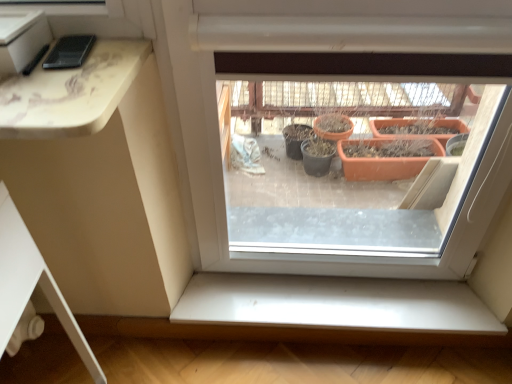
The height and width of the screenshot is (384, 512). Find the location of `white smooth window sill at lower center`. white smooth window sill at lower center is located at coordinates (335, 303).

The height and width of the screenshot is (384, 512). Describe the element at coordinates (335, 303) in the screenshot. I see `white smooth window sill at lower center` at that location.

Describe the element at coordinates (21, 39) in the screenshot. This screenshot has height=384, width=512. I see `matte black phone at upper left` at that location.

Measure the distance between matte black phone at upper left and camera.

They are 72.07 centimeters apart.

This screenshot has height=384, width=512. I want to click on matte black phone at upper left, so click(21, 39).

In order to face matte black phone at upper left, should I rotate leftwards or rightwards?

To face it directly, rotate left by 32.433 degrees.

Locate an element on the screen. The width and height of the screenshot is (512, 384). white smooth window sill at lower center is located at coordinates (335, 303).

Which is more to the left, matte black phone at upper left or white smooth window sill at lower center?

Positioned to the left is matte black phone at upper left.

Is matte black phone at upper left in front of white smooth window sill at lower center?

Yes, it is.

Considering the points (9, 40) and (424, 289), which point is behind, point (9, 40) or point (424, 289)?

The point (424, 289) is farther.

From the image's perspective, between matte black phone at upper left and white smooth window sill at lower center, which one is located above?

matte black phone at upper left is shown above in the image.

From a real-world perspective, is matte black phone at upper left located higher than white smooth window sill at lower center?

Yes, from a real-world perspective, matte black phone at upper left is on top of white smooth window sill at lower center.

Considering the sizes of objects matte black phone at upper left and white smooth window sill at lower center in the image provided, who is thinner, matte black phone at upper left or white smooth window sill at lower center?

Thinner between the two is matte black phone at upper left.

Does matte black phone at upper left have a greater height compared to white smooth window sill at lower center?

In fact, matte black phone at upper left may be shorter than white smooth window sill at lower center.

Considering the sizes of objects matte black phone at upper left and white smooth window sill at lower center in the image provided, who is bigger, matte black phone at upper left or white smooth window sill at lower center?

Bigger between the two is white smooth window sill at lower center.

Is white smooth window sill at lower center a part of matte black phone at upper left?

No.

Is matte black phone at upper left in contact with white smooth window sill at lower center?

No, matte black phone at upper left is not next to white smooth window sill at lower center.

Is matte black phone at upper left facing towards white smooth window sill at lower center?

No, matte black phone at upper left does not turn towards white smooth window sill at lower center.

Image resolution: width=512 pixels, height=384 pixels. I want to click on window box on the left of the white smooth window sill at lower center, so click(x=21, y=39).

Does white smooth window sill at lower center appear on the right side of matte black phone at upper left?

Correct, you'll find white smooth window sill at lower center to the right of matte black phone at upper left.

Who is more distant, white smooth window sill at lower center or matte black phone at upper left?

white smooth window sill at lower center is behind.

Is point (331, 278) positioned before point (48, 42)?

No, (331, 278) is behind (48, 42).

From the image's perspective, is white smooth window sill at lower center on matte black phone at upper left?

Incorrect, from the image's perspective, white smooth window sill at lower center is lower than matte black phone at upper left.

From a real-world perspective, is white smooth window sill at lower center above or below matte black phone at upper left?

From a real-world perspective, white smooth window sill at lower center is physically below matte black phone at upper left.

Looking at this image, looking at their sizes, would you say white smooth window sill at lower center is wider or thinner than matte black phone at upper left?

Clearly, white smooth window sill at lower center has more width compared to matte black phone at upper left.

In the scene shown: Is white smooth window sill at lower center shorter than matte black phone at upper left?

No.

Can you confirm if white smooth window sill at lower center is smaller than matte black phone at upper left?

No.

Based on the photo, is white smooth window sill at lower center not within matte black phone at upper left?

That's correct, white smooth window sill at lower center is outside of matte black phone at upper left.

Is the surface of white smooth window sill at lower center in direct contact with matte black phone at upper left?

No, white smooth window sill at lower center is not next to matte black phone at upper left.

Is matte black phone at upper left at the back of white smooth window sill at lower center?

white smooth window sill at lower center does not have its back to matte black phone at upper left.

Can you tell me how much white smooth window sill at lower center and matte black phone at upper left differ in facing direction?

0.299 degrees separate the facing orientations of white smooth window sill at lower center and matte black phone at upper left.

The height and width of the screenshot is (384, 512). In order to click on window sill located on the right of matte black phone at upper left in this screenshot , I will do `click(335, 303)`.

Image resolution: width=512 pixels, height=384 pixels. Find the location of `window box above the white smooth window sill at lower center (from the image's perspective)`. window box above the white smooth window sill at lower center (from the image's perspective) is located at coordinates (21, 39).

This screenshot has width=512, height=384. I want to click on window box in front of the white smooth window sill at lower center, so click(21, 39).